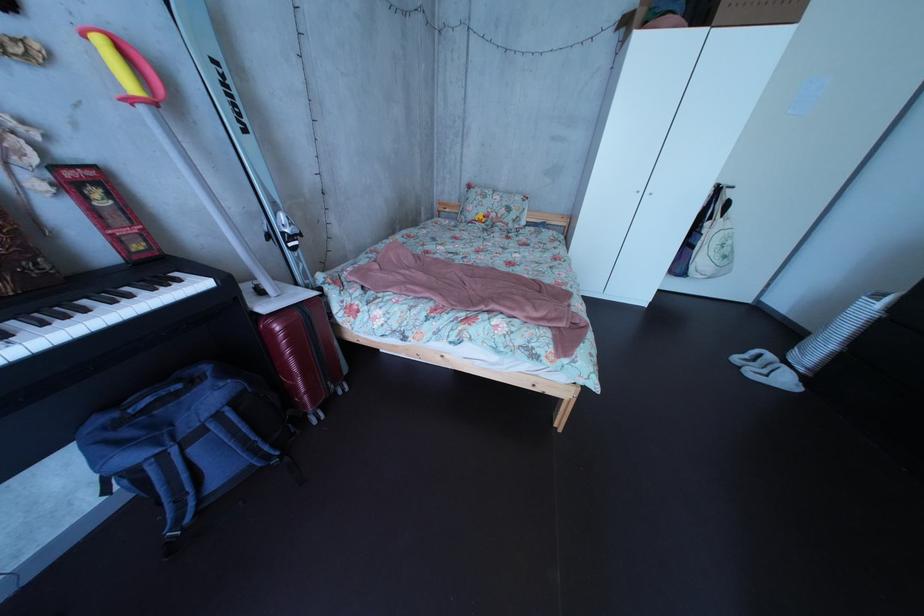
The location [492,207] corresponds to which object?

It corresponds to the floral pattern pillow in the image.